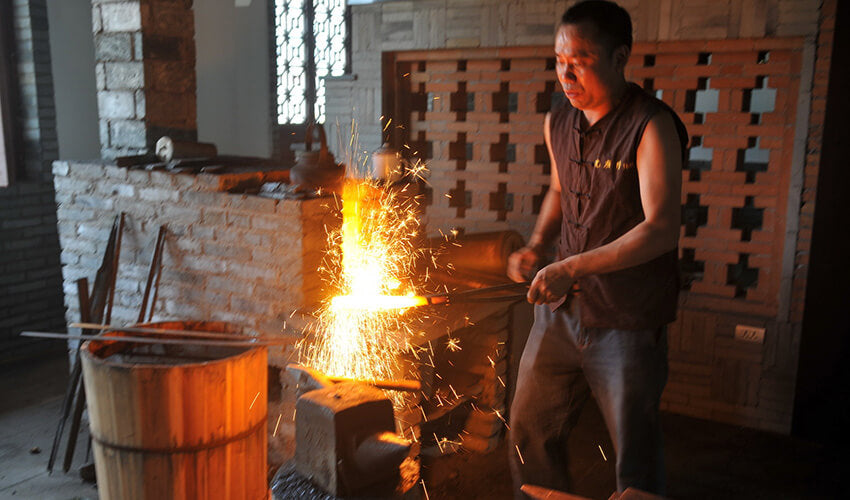
Identify the location of brick walls. (253, 273), (477, 115).